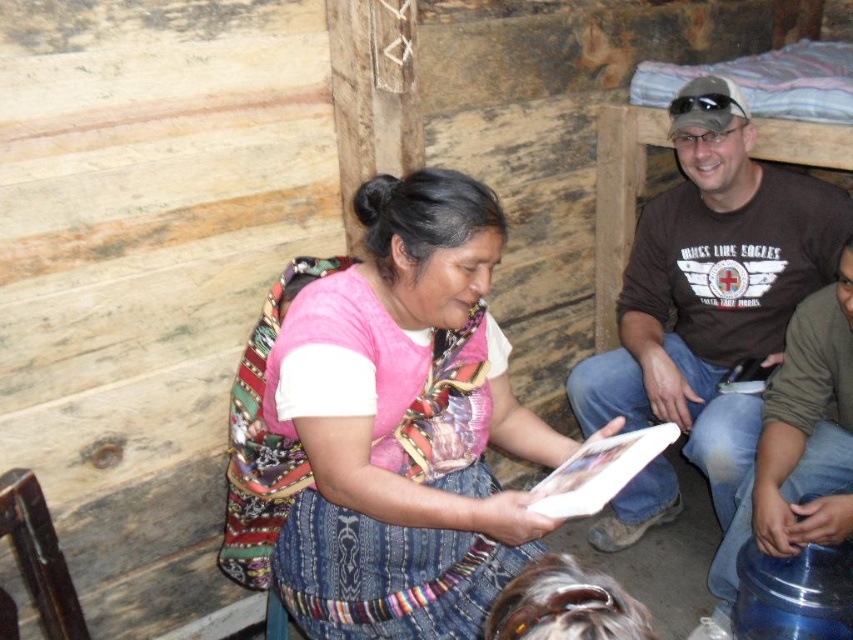
Question: Is pink fabric at center positioned behind brown cotton t-shirt at upper right?

Choices:
 (A) no
 (B) yes

Answer: (A)

Question: Which of the following is the farthest from the observer?

Choices:
 (A) brown cotton t-shirt at upper right
 (B) pink fabric at center

Answer: (A)

Question: Is pink fabric at center bigger than brown cotton t-shirt at upper right?

Choices:
 (A) yes
 (B) no

Answer: (B)

Question: Is pink fabric at center bigger than brown cotton t-shirt at upper right?

Choices:
 (A) yes
 (B) no

Answer: (B)

Question: Which point is closer to the camera?

Choices:
 (A) pink fabric at center
 (B) brown cotton t-shirt at upper right

Answer: (A)

Question: Among these objects, which one is farthest from the camera?

Choices:
 (A) pink fabric at center
 (B) brown cotton t-shirt at upper right

Answer: (B)